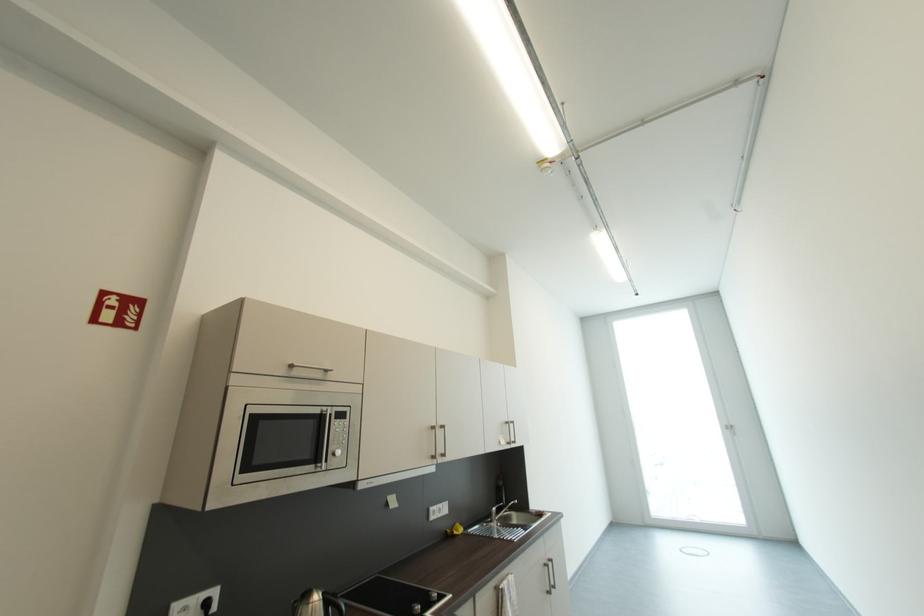
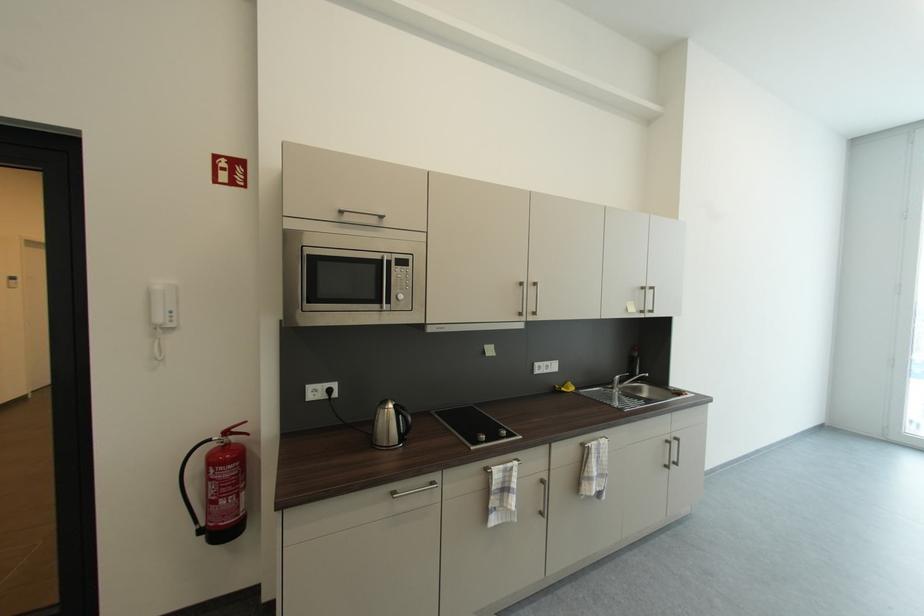
Find the pixel in the second image that matches (553,564) in the first image.

(675, 440)